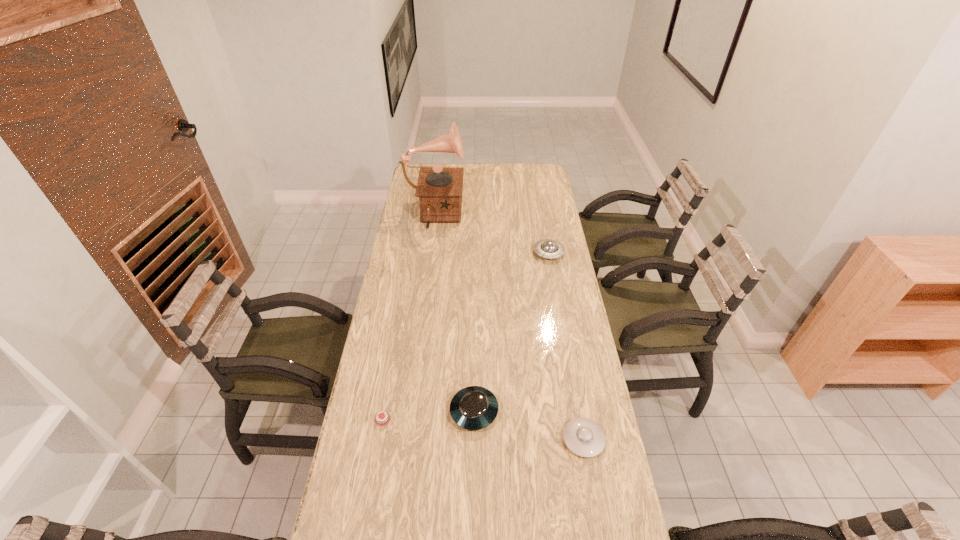
Point out which saucer is positioned as the second nearest to the fourth tallest object. Please provide its 2D coordinates. Your answer should be formatted as a tuple, i.e. [(x, y)], where the tuple contains the x and y coordinates of a point satisfying the conditions above.

[(547, 248)]

Where is `vacant space that satisfies the following two spatial constraints: 1. on the back side of the leftmost saucer; 2. on the right side of the chocolate cake`? This screenshot has height=540, width=960. vacant space that satisfies the following two spatial constraints: 1. on the back side of the leftmost saucer; 2. on the right side of the chocolate cake is located at coordinates [x=384, y=411].

Identify the location of vacant space that satisfies the following two spatial constraints: 1. on the horn of the leftmost saucer; 2. on the left side of the record player. This screenshot has width=960, height=540. (408, 411).

Identify the location of vacant area in the image that satisfies the following two spatial constraints: 1. on the horn of the tallest object; 2. on the front side of the chocolate cake. click(x=407, y=419).

Locate an element on the screen. This screenshot has height=540, width=960. vacant space that satisfies the following two spatial constraints: 1. on the horn of the farthest saucer; 2. on the left side of the record player is located at coordinates (429, 253).

This screenshot has height=540, width=960. In order to click on free spot that satisfies the following two spatial constraints: 1. on the horn of the farthest object; 2. on the back side of the leftmost saucer in this screenshot , I will do `click(408, 411)`.

Locate an element on the screen. vacant space that satisfies the following two spatial constraints: 1. on the horn of the farthest object; 2. on the right side of the farthest saucer is located at coordinates (429, 253).